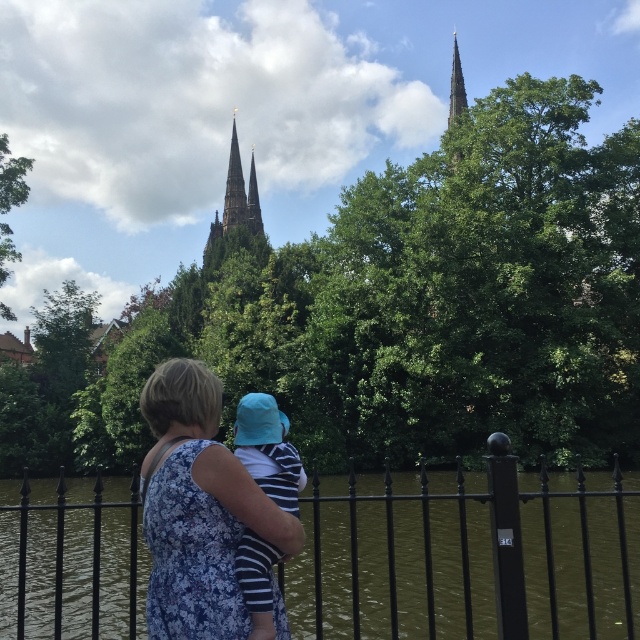
Question: Does black wrought iron fence at center appear under dark gray stone tower at upper center?

Choices:
 (A) yes
 (B) no

Answer: (A)

Question: Which point appears farthest from the camera in this image?

Choices:
 (A) (259, 236)
 (B) (292, 492)
 (C) (212, 416)
 (D) (257, 221)

Answer: (D)

Question: Does black wrought iron fence at center appear under smooth stone spire at upper center?

Choices:
 (A) no
 (B) yes

Answer: (B)

Question: Can you confirm if blue fabric hat at center is positioned to the right of smooth stone spire at center?

Choices:
 (A) no
 (B) yes

Answer: (B)

Question: Which point is farther to the camera?

Choices:
 (A) (252, 148)
 (B) (257, 188)
 (C) (268, 605)

Answer: (B)

Question: Which point appears farthest from the camera in this image?

Choices:
 (A) (236, 243)
 (B) (264, 518)
 (C) (628, 579)
 (D) (253, 452)

Answer: (A)